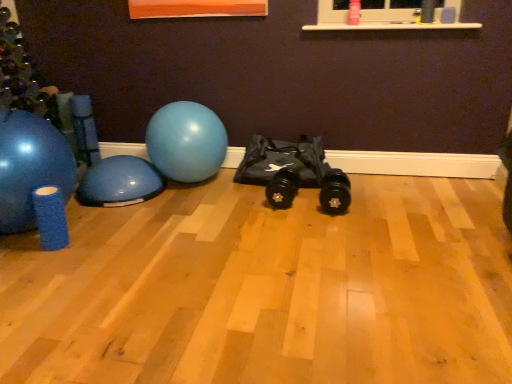
Describe the element at coordinates (30, 167) in the screenshot. I see `matte blue exercise ball at left, arranged as the first ball when viewed from the left` at that location.

In order to click on glossy rubber ball at center, which is the 3th ball in left-to-right order in this screenshot , I will do `click(186, 142)`.

Between blue rubber ball at left, the second ball when ordered from right to left, and glossy rubber ball at center, the first ball when ordered from right to left, which one has less height?

Standing shorter between the two is blue rubber ball at left, the second ball when ordered from right to left.

Is blue rubber ball at left, which ranks as the 2th ball in left-to-right order, not close to glossy rubber ball at center, the first ball when ordered from right to left?

No, blue rubber ball at left, which ranks as the 2th ball in left-to-right order, is not far from glossy rubber ball at center, the first ball when ordered from right to left.

Find the location of a particular element. the 2nd ball positioned below the glossy rubber ball at center, the first ball when ordered from right to left (from the image's perspective) is located at coordinates (120, 182).

From a real-world perspective, is blue rubber ball at left, the second ball when ordered from right to left, over matte blue exercise ball at left, arranged as the first ball when viewed from the left?

No.

Which object is positioned more to the left, blue rubber ball at left, the second ball when ordered from right to left, or matte blue exercise ball at left, arranged as the first ball when viewed from the left?

matte blue exercise ball at left, arranged as the first ball when viewed from the left, is more to the left.

Based on the photo, from the image's perspective, is blue rubber ball at left, which ranks as the 2th ball in left-to-right order, located above or below matte blue exercise ball at left, which is the third ball in right-to-left order?

Based on their image positions, blue rubber ball at left, which ranks as the 2th ball in left-to-right order, is located beneath matte blue exercise ball at left, which is the third ball in right-to-left order.

Is blue rubber ball at left, the second ball when ordered from right to left, oriented away from matte blue exercise ball at left, which is the third ball in right-to-left order?

No, matte blue exercise ball at left, which is the third ball in right-to-left order, is not at the back of blue rubber ball at left, the second ball when ordered from right to left.

Based on the photo, can you confirm if glossy rubber ball at center, which is the 3th ball in left-to-right order, is positioned to the left of blue rubber ball at left, the second ball when ordered from right to left?

No.

Are glossy rubber ball at center, the first ball when ordered from right to left, and blue rubber ball at left, which ranks as the 2th ball in left-to-right order, far apart?

glossy rubber ball at center, the first ball when ordered from right to left, is actually quite close to blue rubber ball at left, which ranks as the 2th ball in left-to-right order.

What's the angular difference between glossy rubber ball at center, which is the 3th ball in left-to-right order, and blue rubber ball at left, the second ball when ordered from right to left,'s facing directions?

The angle between the facing direction of glossy rubber ball at center, which is the 3th ball in left-to-right order, and the facing direction of blue rubber ball at left, the second ball when ordered from right to left, is 90 degrees.

Where is `ball that is above the glossy rubber ball at center, the first ball when ordered from right to left (from a real-world perspective)`? The width and height of the screenshot is (512, 384). ball that is above the glossy rubber ball at center, the first ball when ordered from right to left (from a real-world perspective) is located at coordinates (30, 167).

Is matte blue exercise ball at left, arranged as the first ball when viewed from the left, aimed at glossy rubber ball at center, the first ball when ordered from right to left?

No, matte blue exercise ball at left, arranged as the first ball when viewed from the left, is not oriented towards glossy rubber ball at center, the first ball when ordered from right to left.

Considering the sizes of objects matte blue exercise ball at left, which is the third ball in right-to-left order, and glossy rubber ball at center, which is the 3th ball in left-to-right order, in the image provided, who is smaller, matte blue exercise ball at left, which is the third ball in right-to-left order, or glossy rubber ball at center, which is the 3th ball in left-to-right order,?

glossy rubber ball at center, which is the 3th ball in left-to-right order.

Considering the relative sizes of matte blue exercise ball at left, arranged as the first ball when viewed from the left, and glossy rubber ball at center, the first ball when ordered from right to left, in the image provided, is matte blue exercise ball at left, arranged as the first ball when viewed from the left, wider than glossy rubber ball at center, the first ball when ordered from right to left,?

Yes, matte blue exercise ball at left, arranged as the first ball when viewed from the left, is wider than glossy rubber ball at center, the first ball when ordered from right to left.

Based on the photo, choose the correct answer: Is matte blue exercise ball at left, which is the third ball in right-to-left order, inside blue rubber ball at left, which ranks as the 2th ball in left-to-right order, or outside it?

The correct answer is: outside.

Which point is more distant from viewer, (34, 213) or (137, 176)?

Point (137, 176)

Is matte blue exercise ball at left, which is the third ball in right-to-left order, not near blue rubber ball at left, the second ball when ordered from right to left?

They are positioned close to each other.

Considering the sizes of objects matte blue exercise ball at left, which is the third ball in right-to-left order, and blue rubber ball at left, which ranks as the 2th ball in left-to-right order, in the image provided, who is wider, matte blue exercise ball at left, which is the third ball in right-to-left order, or blue rubber ball at left, which ranks as the 2th ball in left-to-right order,?

Wider between the two is blue rubber ball at left, which ranks as the 2th ball in left-to-right order.

Where is `the 2nd ball behind the matte blue exercise ball at left, which is the third ball in right-to-left order, counting from the anchor's position`? The width and height of the screenshot is (512, 384). the 2nd ball behind the matte blue exercise ball at left, which is the third ball in right-to-left order, counting from the anchor's position is located at coordinates (186, 142).

Can we say glossy rubber ball at center, the first ball when ordered from right to left, lies outside matte blue exercise ball at left, arranged as the first ball when viewed from the left?

Yes.

From the image's perspective, does glossy rubber ball at center, which is the 3th ball in left-to-right order, appear higher than matte blue exercise ball at left, arranged as the first ball when viewed from the left?

Indeed, from the image's perspective, glossy rubber ball at center, which is the 3th ball in left-to-right order, is shown above matte blue exercise ball at left, arranged as the first ball when viewed from the left.

Is glossy rubber ball at center, which is the 3th ball in left-to-right order, aimed at matte blue exercise ball at left, which is the third ball in right-to-left order?

No.

Identify the location of ball on the right of blue rubber ball at left, which ranks as the 2th ball in left-to-right order. (186, 142).

Starting from the matte blue exercise ball at left, arranged as the first ball when viewed from the left, which ball is the 1st one behind? Please provide its 2D coordinates.

[(120, 182)]

Based on their spatial positions, is glossy rubber ball at center, which is the 3th ball in left-to-right order, or matte blue exercise ball at left, arranged as the first ball when viewed from the left, further from blue rubber ball at left, the second ball when ordered from right to left?

The object further to blue rubber ball at left, the second ball when ordered from right to left, is matte blue exercise ball at left, arranged as the first ball when viewed from the left.

Estimate the real-world distances between objects in this image. Which object is closer to matte blue exercise ball at left, arranged as the first ball when viewed from the left, glossy rubber ball at center, which is the 3th ball in left-to-right order, or blue rubber ball at left, which ranks as the 2th ball in left-to-right order?

blue rubber ball at left, which ranks as the 2th ball in left-to-right order, lies closer to matte blue exercise ball at left, arranged as the first ball when viewed from the left, than the other object.

From the image, which object appears to be farther from glossy rubber ball at center, the first ball when ordered from right to left, blue rubber ball at left, which ranks as the 2th ball in left-to-right order, or matte blue exercise ball at left, which is the third ball in right-to-left order?

matte blue exercise ball at left, which is the third ball in right-to-left order, lies further to glossy rubber ball at center, the first ball when ordered from right to left, than the other object.

Looking at the image, which one is located further to glossy rubber ball at center, which is the 3th ball in left-to-right order, matte blue exercise ball at left, arranged as the first ball when viewed from the left, or blue rubber ball at left, which ranks as the 2th ball in left-to-right order?

Based on the image, matte blue exercise ball at left, arranged as the first ball when viewed from the left, appears to be further to glossy rubber ball at center, which is the 3th ball in left-to-right order.

Estimate the real-world distances between objects in this image. Which object is further from blue rubber ball at left, which ranks as the 2th ball in left-to-right order, matte blue exercise ball at left, which is the third ball in right-to-left order, or glossy rubber ball at center, which is the 3th ball in left-to-right order?

matte blue exercise ball at left, which is the third ball in right-to-left order, is further to blue rubber ball at left, which ranks as the 2th ball in left-to-right order.

Based on their spatial positions, is blue rubber ball at left, the second ball when ordered from right to left, or glossy rubber ball at center, which is the 3th ball in left-to-right order, further from matte blue exercise ball at left, arranged as the first ball when viewed from the left?

glossy rubber ball at center, which is the 3th ball in left-to-right order, is further to matte blue exercise ball at left, arranged as the first ball when viewed from the left.

Where is `ball between matte blue exercise ball at left, arranged as the first ball when viewed from the left, and glossy rubber ball at center, which is the 3th ball in left-to-right order`? This screenshot has height=384, width=512. ball between matte blue exercise ball at left, arranged as the first ball when viewed from the left, and glossy rubber ball at center, which is the 3th ball in left-to-right order is located at coordinates (120, 182).